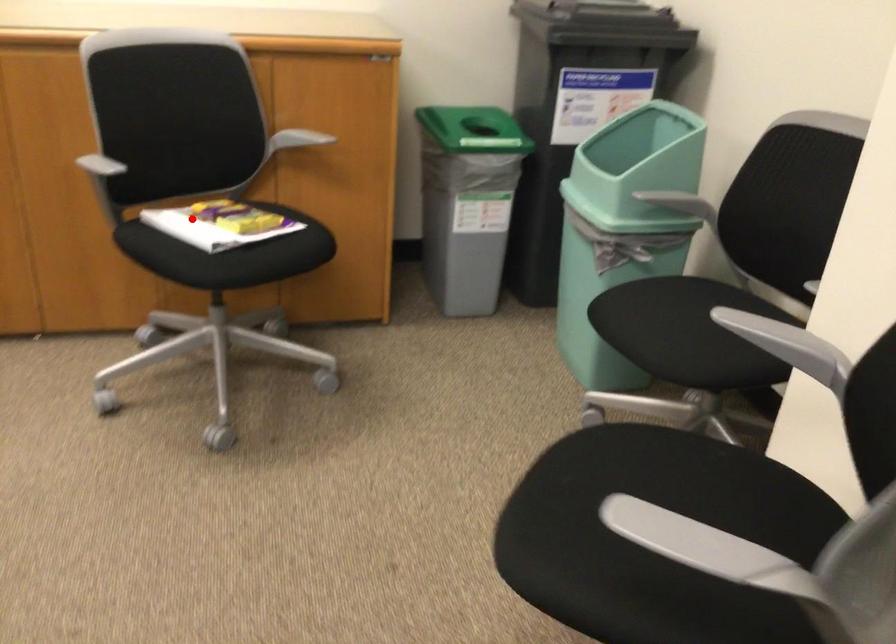
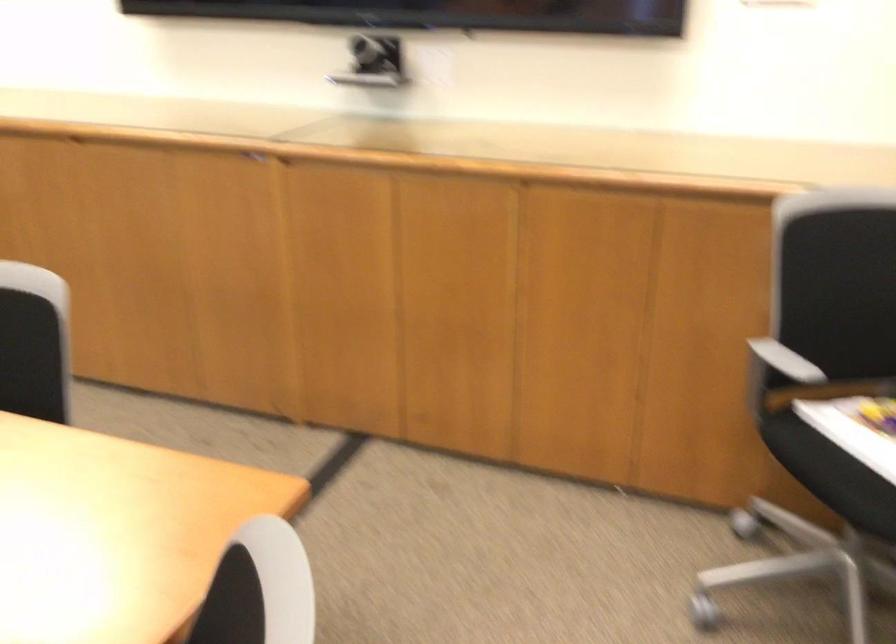
Question: I am providing you with two images of the same scene from different viewpoints. Image1 has a red point marked. In image2, the corresponding 3D location appears at what relative position? Reply with the corresponding letter.

Choices:
 (A) Closer
 (B) Farther

Answer: (A)